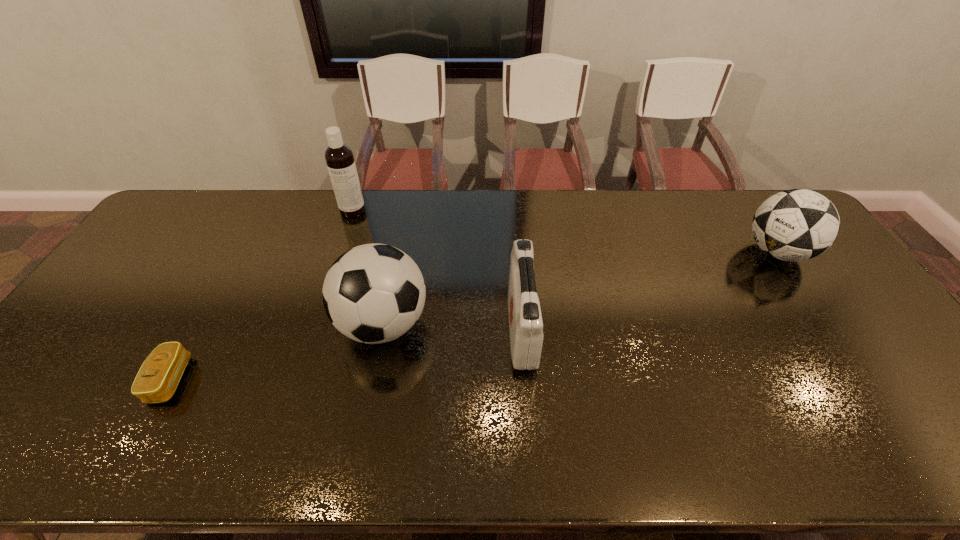
Identify the location of the farthest object. Image resolution: width=960 pixels, height=540 pixels. (339, 157).

The width and height of the screenshot is (960, 540). Identify the location of the tallest object. (339, 157).

Find the location of a particular element. The width and height of the screenshot is (960, 540). the nearer soccer ball is located at coordinates (374, 293).

Locate an element on the screen. the third object from right to left is located at coordinates point(374,293).

This screenshot has width=960, height=540. I want to click on the shorter soccer ball, so click(793, 225).

This screenshot has height=540, width=960. In order to click on the rightmost object in this screenshot , I will do `click(793, 225)`.

Where is `the second object from right to left`? The width and height of the screenshot is (960, 540). the second object from right to left is located at coordinates (526, 336).

Image resolution: width=960 pixels, height=540 pixels. Identify the location of clutch bag. (159, 375).

This screenshot has width=960, height=540. I want to click on the leftmost object, so click(x=159, y=375).

Identify the location of vacant space located 0.340m on the label side of the tallest object. (326, 292).